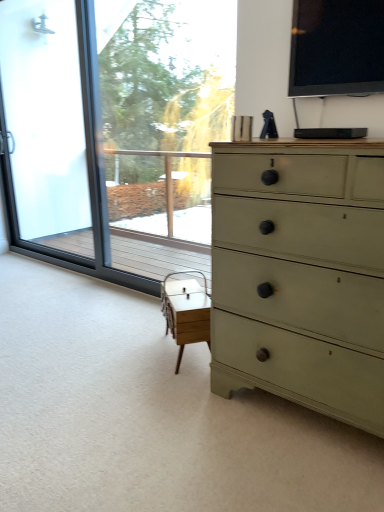
Question: Is white wood table at center in front of or behind black glossy tv at upper right, the first window screen positioned from the right, in the image?

Choices:
 (A) behind
 (B) front

Answer: (A)

Question: Do you think white wood table at center is within black glossy tv at upper right, the first window screen in the front-to-back sequence, or outside of it?

Choices:
 (A) inside
 (B) outside

Answer: (B)

Question: Which object is positioned farthest from the black glossy tv at upper right, positioned as the second window screen in back-to-front order?

Choices:
 (A) white wood table at center
 (B) transparent glass window at left, which is the 2th window screen in right-to-left order
 (C) frosted glass screen door at left
 (D) matte green dresser at right

Answer: (C)

Question: Which is nearer to the white wood table at center?

Choices:
 (A) matte green dresser at right
 (B) transparent glass window at left, which is the 2th window screen in right-to-left order
 (C) black glossy tv at upper right, acting as the 2th window screen starting from the left
 (D) frosted glass screen door at left

Answer: (A)